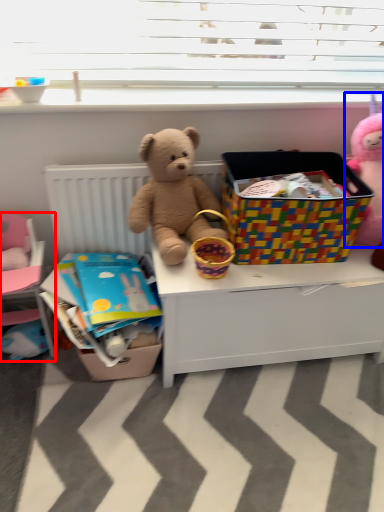
Question: Which object is further to the camera taking this photo, bed (highlighted by a red box) or toy (highlighted by a blue box)?

Choices:
 (A) bed
 (B) toy

Answer: (A)